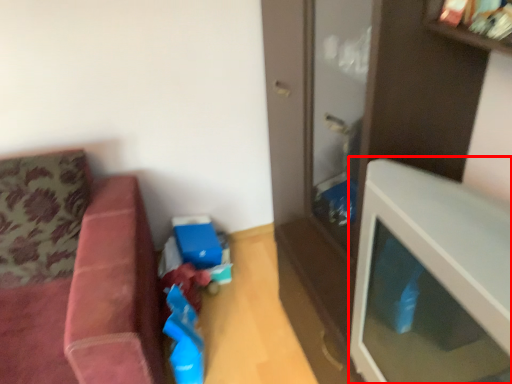
Question: From the image's perspective, considering the relative positions of table (annotated by the red box) and studio couch in the image provided, where is table (annotated by the red box) located with respect to the staircase?

Choices:
 (A) above
 (B) below

Answer: (A)